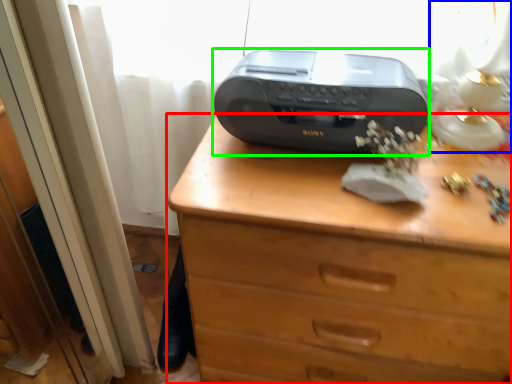
Question: Estimate the real-world distances between objects in this image. Which object is farther from chest of drawers (highlighted by a red box), table lamp (highlighted by a blue box) or printer (highlighted by a green box)?

Choices:
 (A) table lamp
 (B) printer

Answer: (A)